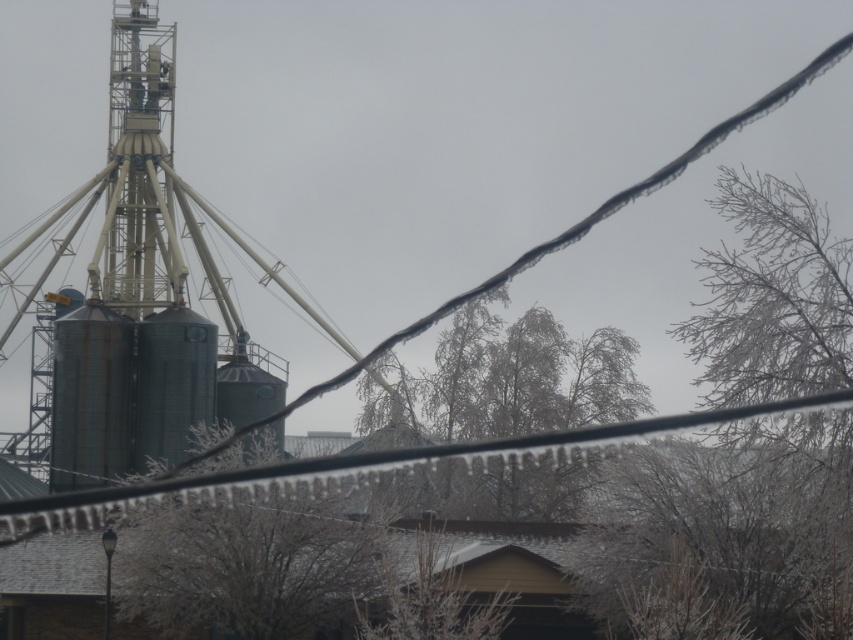
Which is in front, point (496, 481) or point (426, 556)?

Point (426, 556) is in front.

In the scene shown: Is snow-covered branches at center smaller than brown wood tree at center?

No.

Find the location of a particular element. Image resolution: width=853 pixels, height=640 pixels. snow-covered branches at center is located at coordinates [506, 380].

Which is in front, point (323, 536) or point (407, 628)?

Positioned in front is point (407, 628).

Does brown textured tree at center appear under brown wood tree at center?

No.

Who is more forward, (314, 611) or (390, 604)?

Positioned in front is point (390, 604).

This screenshot has width=853, height=640. I want to click on brown textured tree at center, so click(x=247, y=564).

Between brown textured tree at center and snow-covered branches at center, which one is positioned higher?

snow-covered branches at center

Between brown textured tree at center and snow-covered branches at center, which one is positioned lower?

brown textured tree at center is lower down.

Find the location of a particular element. The height and width of the screenshot is (640, 853). brown textured tree at center is located at coordinates (247, 564).